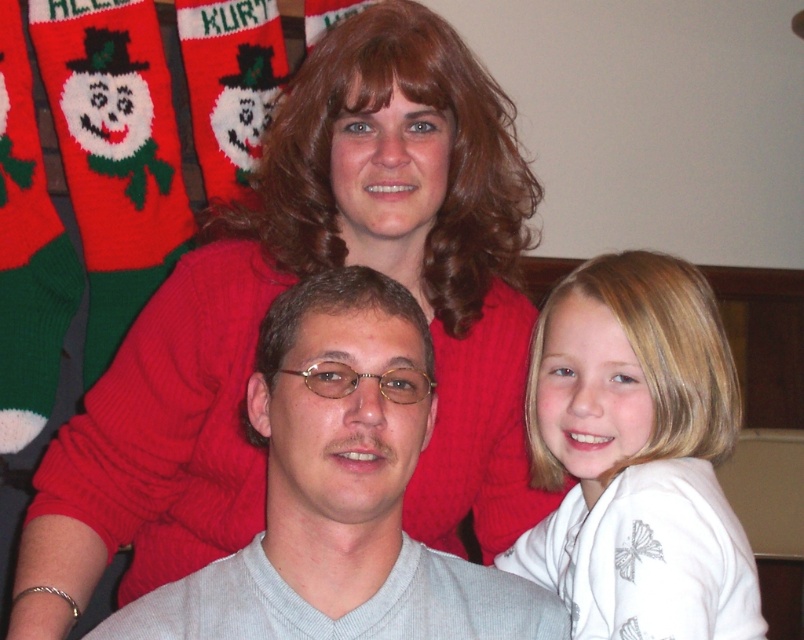
Does gray knit sweater at center appear under white satin shirt at right?

Yes.

This screenshot has width=804, height=640. What are the coordinates of `gray knit sweater at center` in the screenshot? It's located at (339, 493).